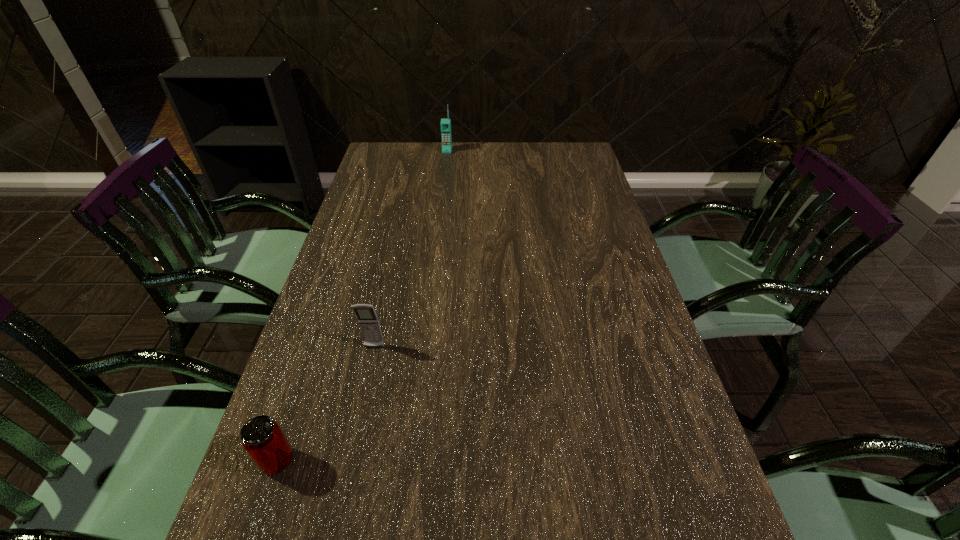
You are a GUI agent. You are given a task and a screenshot of the screen. Output one action in this format:
    pyautogui.click(x=<x>, y=<y>)
    Task: Click on the farther cellular telephone
    The image size is (960, 540).
    Given the screenshot: What is the action you would take?
    pyautogui.click(x=445, y=123)

Find the location of a particular element. This screenshot has width=960, height=540. the farthest object is located at coordinates (445, 123).

Locate an element on the screen. the second object from right to left is located at coordinates (368, 321).

Identify the location of the second shortest object. This screenshot has height=540, width=960. (368, 321).

You are a GUI agent. You are given a task and a screenshot of the screen. Output one action in this format:
    pyautogui.click(x=<x>, y=<y>)
    Task: Click on the leftmost object
    
    Given the screenshot: What is the action you would take?
    pyautogui.click(x=262, y=438)

Where is `the nearest object`? the nearest object is located at coordinates (262, 438).

Image resolution: width=960 pixels, height=540 pixels. In order to click on vacant area located 0.310m on the keypad of the farther cellular telephone in this screenshot , I will do pos(442,198).

Identify the location of vacant space located 0.250m on the front-facing side of the second farthest object. (350, 457).

At what (x,y) coordinates should I click in order to perform the action: click on free space located on the right of the nearest object. Please return your answer as a coordinate pair (x, y). The height and width of the screenshot is (540, 960). Looking at the image, I should click on (480, 461).

This screenshot has width=960, height=540. In order to click on object positioned at the far edge in this screenshot , I will do `click(445, 123)`.